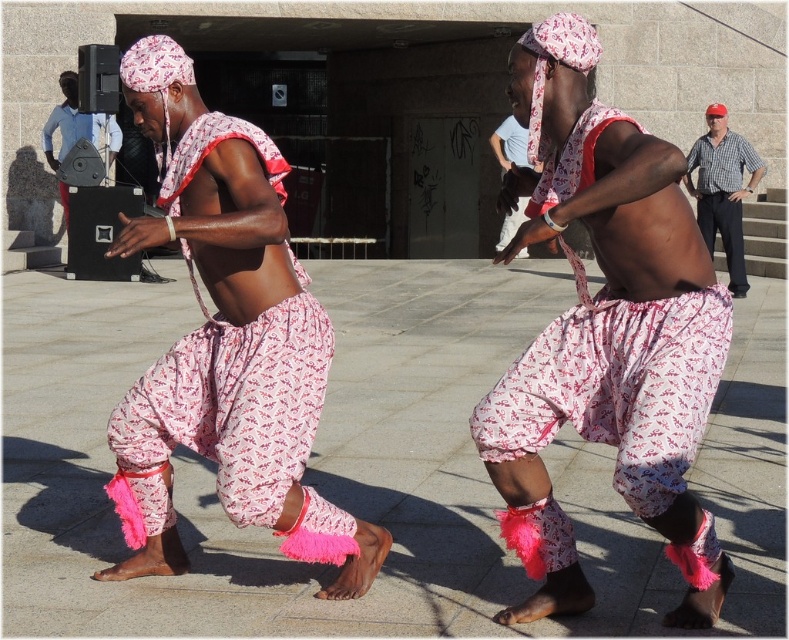
Who is taller, pink printed pants at center or light blue cotton shirt at upper center?

light blue cotton shirt at upper center is taller.

This screenshot has height=640, width=789. Describe the element at coordinates (226, 342) in the screenshot. I see `pink printed pants at center` at that location.

Is point (312, 324) closer to camera compared to point (518, 154)?

Yes, point (312, 324) is closer to viewer.

Identify the location of pink printed pants at center. This screenshot has height=640, width=789. click(226, 342).

Can you confirm if pink fabric pants at center is thinner than checkered shirt at right?

Incorrect, pink fabric pants at center's width is not less than checkered shirt at right's.

Describe the element at coordinates (604, 332) in the screenshot. I see `pink fabric pants at center` at that location.

Locate an element on the screen. The width and height of the screenshot is (789, 640). pink fabric pants at center is located at coordinates (604, 332).

Is pink printed pants at center wider than checkered shirt at right?

Correct, the width of pink printed pants at center exceeds that of checkered shirt at right.

Is point (264, 138) positioned before point (722, 164)?

Yes.

Between point (301, 392) and point (698, 220), which one is positioned in front?

Point (301, 392)

Locate an element on the screen. This screenshot has height=640, width=789. pink printed pants at center is located at coordinates (226, 342).